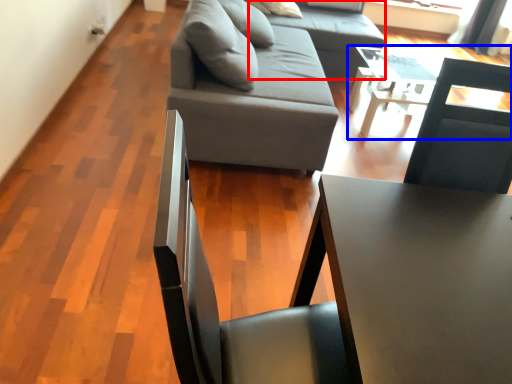
Question: Which object is closer to the camera taking this photo, couch (highlighted by a red box) or table (highlighted by a blue box)?

Choices:
 (A) couch
 (B) table

Answer: (B)